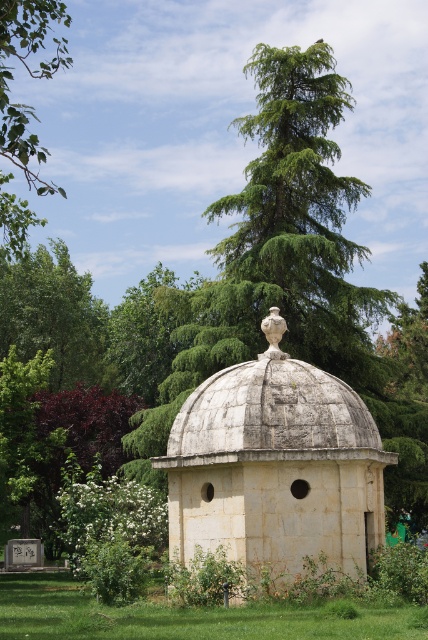
Between green grass at lower center and green leafy branch at upper left, which one appears on the right side from the viewer's perspective?

green grass at lower center

Is point (312, 621) positioned after point (2, 76)?

Yes, it is behind point (2, 76).

Locate an element on the screen. This screenshot has width=428, height=640. green grass at lower center is located at coordinates (184, 616).

How distant is green leafy tree at center from white stone gazebo at center?

The distance of green leafy tree at center from white stone gazebo at center is 13.33 meters.

Can you confirm if green leafy tree at center is taller than white stone gazebo at center?

Indeed, green leafy tree at center has a greater height compared to white stone gazebo at center.

Image resolution: width=428 pixels, height=640 pixels. What do you see at coordinates (296, 278) in the screenshot?
I see `green leafy tree at center` at bounding box center [296, 278].

Locate an element on the screen. The height and width of the screenshot is (640, 428). green leafy tree at center is located at coordinates (296, 278).

Does white stone gazebo at center appear on the left side of green leafy branch at upper left?

Incorrect, white stone gazebo at center is not on the left side of green leafy branch at upper left.

Is point (252, 440) closer to camera compared to point (6, 54)?

Yes, point (252, 440) is closer to viewer.

At what (x,y) coordinates should I click in order to perform the action: click on white stone gazebo at center. Please return your answer as a coordinate pair (x, y). The width and height of the screenshot is (428, 640). Looking at the image, I should click on (276, 467).